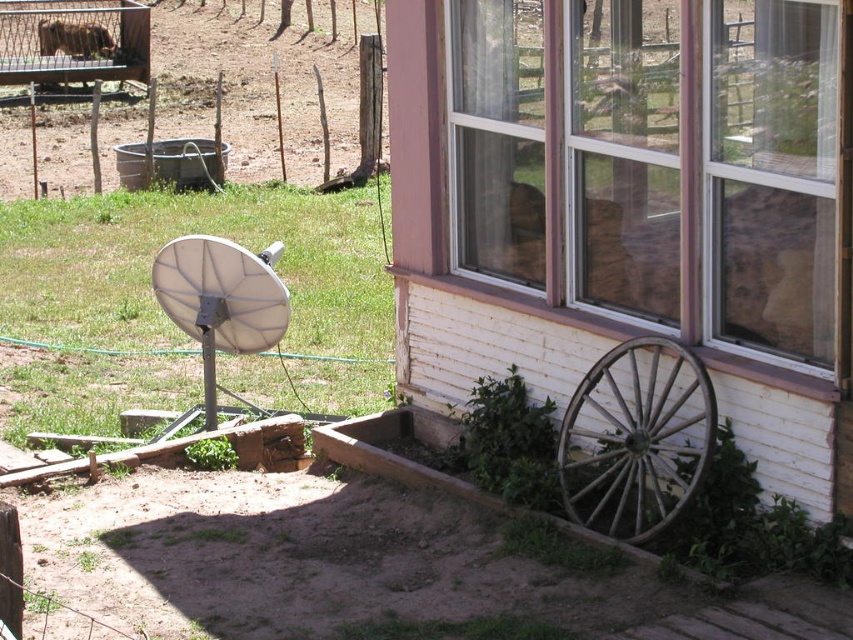
You are standing in the garden bed and want to move towards the house. Which object, the weathered wood wagon wheel at lower right or the brown wooden wagon at upper left, would you pass closer to first?

The weathered wood wagon wheel at lower right is closer to the viewer than the brown wooden wagon at upper left, so you would pass closer to the weathered wood wagon wheel at lower right first as you move towards the house.

In the scene shown: You are a window cleaner standing on the ground. You need to clean both the clear glass window at lower right and the white matte satellite dish at left. Which object should you clean first if you want to start with the one that is higher up?

The clear glass window at lower right is above the white matte satellite dish at left, so you should clean the clear glass window at lower right first since it is higher up.